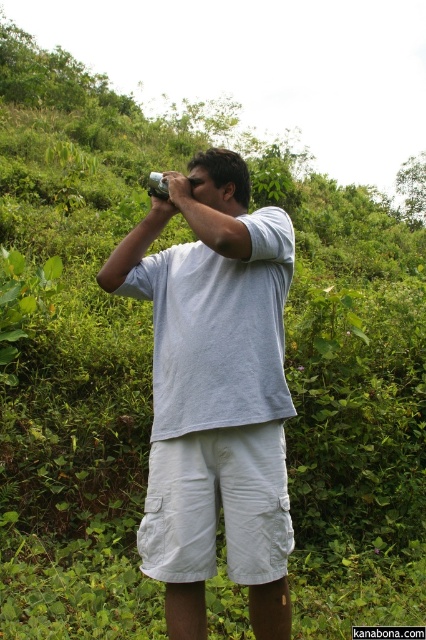
You are a fashion designer analyzing the clothing of a person in a forest scene. You notice the white cotton shirt at center and white cotton shorts at center. Which clothing item is wider in terms of its horizontal measurement?

The white cotton shirt at center is wider than the white cotton shorts at center according to the description.

You are a drone operator trying to capture a photo of the white cotton shirt at center. The drone is currently at coordinates point A. To ensure the shirt is in the frame, where should you position the drone relative to the shirt?

The white cotton shirt at center is located at point (215,392), so the drone should be positioned above the shirt to capture it in the frame.

You are a fashion designer analyzing clothing items in an outdoor setting. You notice the white cotton shirt at center and the white cotton shorts at center. Which clothing item is positioned higher on the person?

The white cotton shirt at center is located above the white cotton shorts at center.